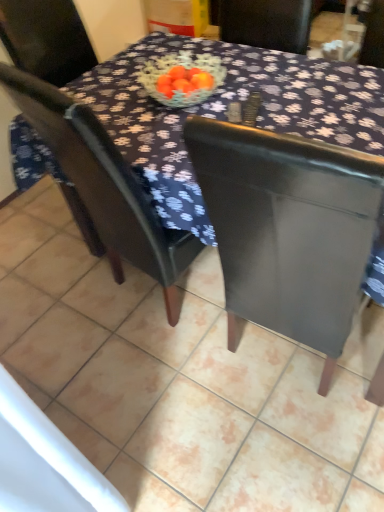
Question: From their relative heights in the image, would you say matte black chair at center is taller or shorter than matte black table at center?

Choices:
 (A) tall
 (B) short

Answer: (A)

Question: Do you think matte black chair at center is within matte black table at center, or outside of it?

Choices:
 (A) outside
 (B) inside

Answer: (A)

Question: Considering the real-world distances, which object is farthest from the matte black table at center?

Choices:
 (A) dark fabric table at center
 (B) matte black chair at center

Answer: (A)

Question: Which is nearer to the matte black chair at center?

Choices:
 (A) dark fabric table at center
 (B) matte black table at center

Answer: (A)